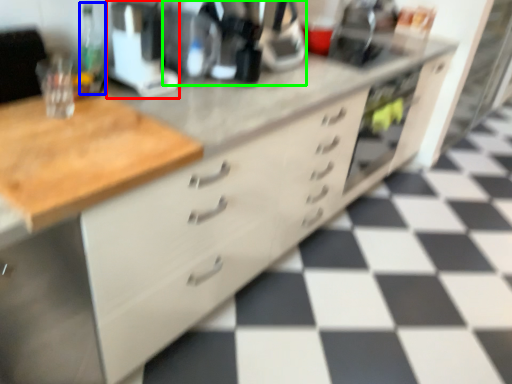
Question: Which object is positioned farthest from appliance (highlighted by a red box)? Select from bottle (highlighted by a blue box) and coffee machine (highlighted by a green box).

Choices:
 (A) bottle
 (B) coffee machine

Answer: (B)